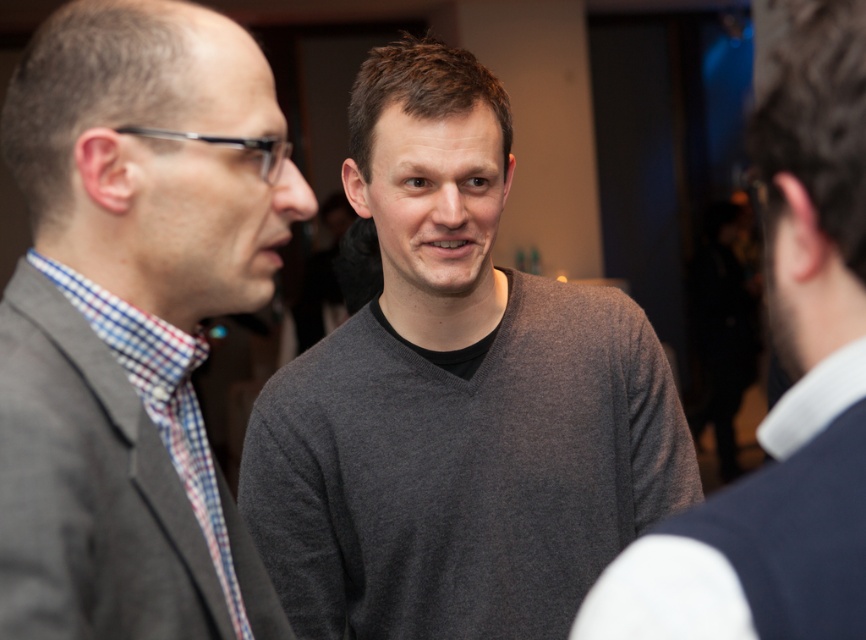
I want to click on matte gray sweater at center, so click(154, 161).

Is point (62, 97) closer to camera compared to point (716, 586)?

No.

Find the location of a particular element. matte gray sweater at center is located at coordinates (154, 161).

Between point (558, 548) and point (243, 636), which one is positioned in front?

Point (243, 636) is in front.

Identify the location of gray matte sweater at center. The height and width of the screenshot is (640, 866). (456, 397).

Does gray matte sweater at center have a greater height compared to matte gray sweater at center?

Yes.

Can you confirm if gray matte sweater at center is smaller than matte gray sweater at center?

Incorrect, gray matte sweater at center is not smaller in size than matte gray sweater at center.

Image resolution: width=866 pixels, height=640 pixels. What do you see at coordinates (456, 397) in the screenshot? I see `gray matte sweater at center` at bounding box center [456, 397].

Where is `gray matte sweater at center`? Image resolution: width=866 pixels, height=640 pixels. gray matte sweater at center is located at coordinates point(456,397).